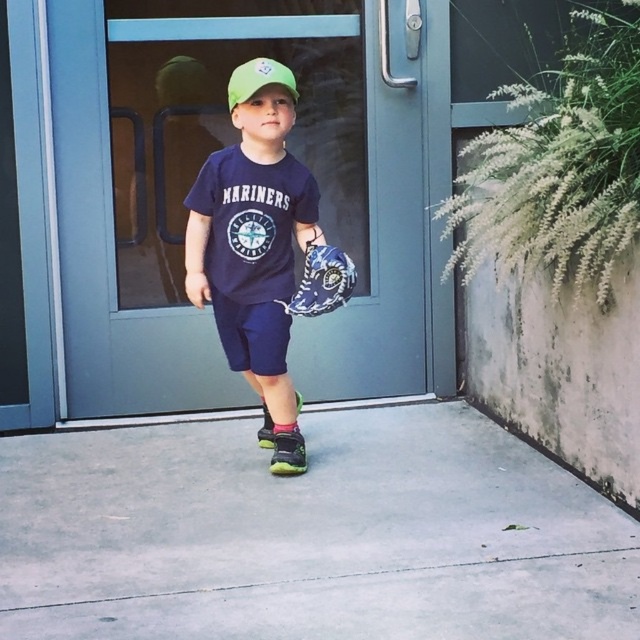
Does point (266, 360) come closer to viewer compared to point (237, 81)?

No.

Is matte blue shorts at center below green matte baseball cap at center?

Yes.

Is point (339, 289) farther from camera compared to point (282, 76)?

Yes, it is.

Find the location of a particular element. This screenshot has height=640, width=640. matte blue shorts at center is located at coordinates (260, 250).

Does blue matte door at center have a larger size compared to matte blue shorts at center?

Correct, blue matte door at center is larger in size than matte blue shorts at center.

Measure the distance from blue matte door at center to matte blue shorts at center.

blue matte door at center is 61.15 centimeters away from matte blue shorts at center.

Is point (220, 13) positioned after point (259, 330)?

That is True.

The width and height of the screenshot is (640, 640). Identify the location of blue matte door at center. (212, 204).

Does point (17, 531) lie behind point (230, 112)?

That is False.

How far apart are gray concrete pavement at center and green matte baseball cap at center?

gray concrete pavement at center is 1.40 meters away from green matte baseball cap at center.

You are a GUI agent. You are given a task and a screenshot of the screen. Output one action in this format:
    pyautogui.click(x=<x>, y=<y>)
    Task: Click on the gray concrete pavement at center
    This screenshot has width=640, height=640.
    Given the screenshot: What is the action you would take?
    pyautogui.click(x=308, y=536)